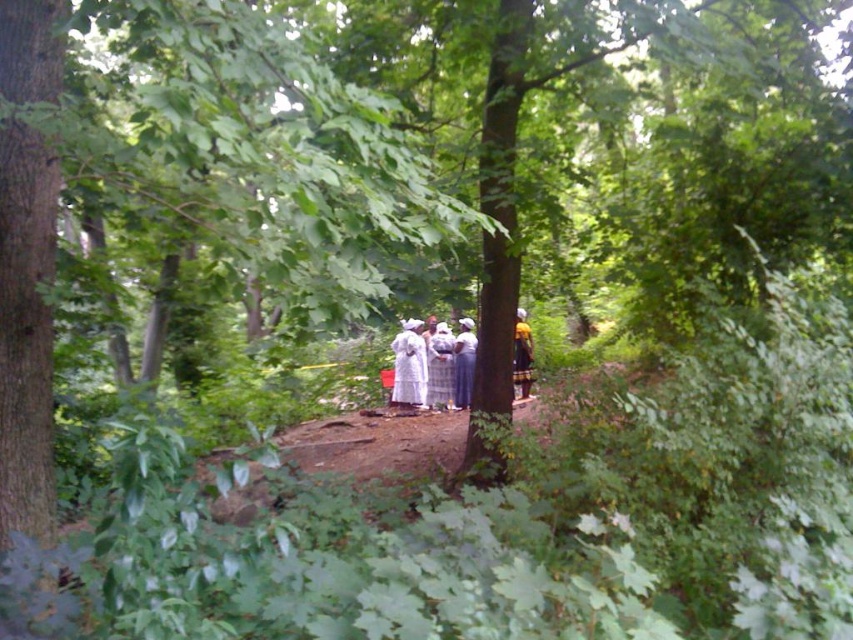
You are standing in the forest and want to reach the point marked as point (424,342). If your walking speed is 3 feet per second, how many seconds will it take you to reach that point?

The point (424,342) is 46.22 feet away from the viewer. At a speed of 3 feet per second, it would take approximately 15.41 seconds to reach the point.

You are a photographer trying to capture a group photo of the people in the forest. You notice the white fabric at center and the yellow fabric dress at center. Which fabric should you focus on to ensure it covers more of the frame horizontally?

The white fabric at center has a larger width than the yellow fabric dress at center, so focusing on it will cover more of the frame horizontally.